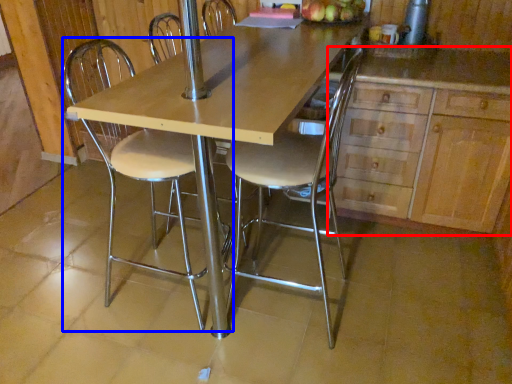
Question: Which object is further to the camera taking this photo, cabinetry (highlighted by a red box) or chair (highlighted by a blue box)?

Choices:
 (A) cabinetry
 (B) chair

Answer: (A)